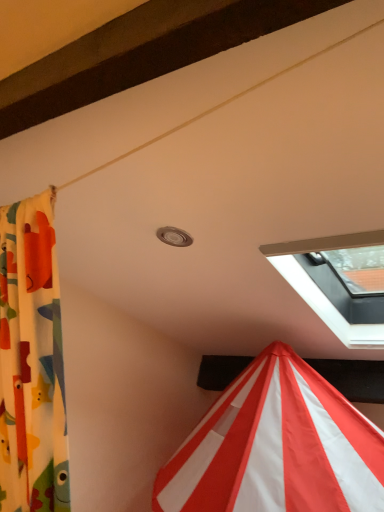
Measure the distance between point (371, 341) and camera.

They are 5.57 feet apart.

In order to face transparent glass window at upper right, should I rotate leftwards or rightwards?

You should rotate right by 21.036 degrees.

You are a GUI agent. You are given a task and a screenshot of the screen. Output one action in this format:
    pyautogui.click(x=<x>, y=<y>)
    Task: Click on the transparent glass window at upper right
    
    Given the screenshot: What is the action you would take?
    pyautogui.click(x=339, y=282)

What do you see at coordinates (339, 282) in the screenshot?
I see `transparent glass window at upper right` at bounding box center [339, 282].

I want to click on transparent glass window at upper right, so click(x=339, y=282).